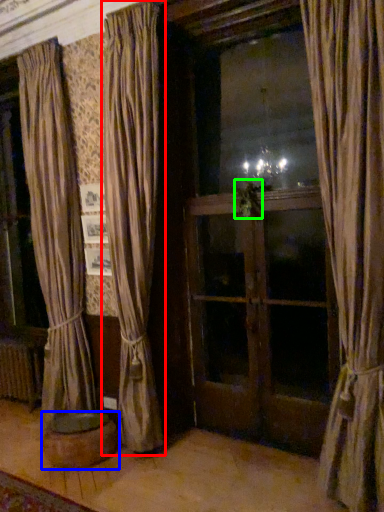
Question: Based on their relative distances, which object is farther from curtain (highlighted by a red box)? Choose from furniture (highlighted by a blue box) and plant (highlighted by a green box).

Choices:
 (A) furniture
 (B) plant

Answer: (B)